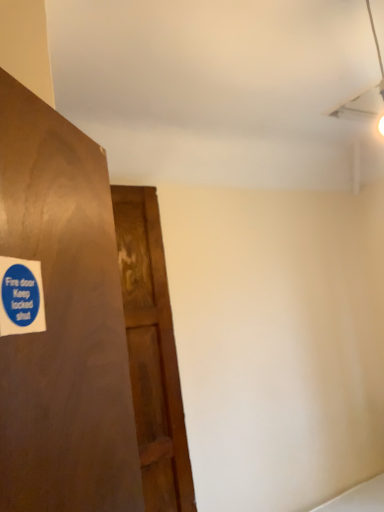
Question: Considering the relative positions of blue paper sticker at left and wooden door at left in the image provided, is blue paper sticker at left to the left of wooden door at left from the viewer's perspective?

Choices:
 (A) yes
 (B) no

Answer: (A)

Question: From a real-world perspective, is blue paper sticker at left located beneath wooden door at left?

Choices:
 (A) no
 (B) yes

Answer: (A)

Question: Is blue paper sticker at left in contact with wooden door at left?

Choices:
 (A) yes
 (B) no

Answer: (B)

Question: Could you tell me if blue paper sticker at left is turned towards wooden door at left?

Choices:
 (A) yes
 (B) no

Answer: (B)

Question: Does blue paper sticker at left have a lesser height compared to wooden door at left?

Choices:
 (A) no
 (B) yes

Answer: (B)

Question: Is wooden door at left located within blue paper sticker at left?

Choices:
 (A) yes
 (B) no

Answer: (B)

Question: Considering the relative sizes of wooden door at left and blue paper sticker at left in the image provided, is wooden door at left shorter than blue paper sticker at left?

Choices:
 (A) no
 (B) yes

Answer: (A)

Question: Is wooden door at left to the left of blue paper sticker at left from the viewer's perspective?

Choices:
 (A) no
 (B) yes

Answer: (A)

Question: Is blue paper sticker at left surrounded by wooden door at left?

Choices:
 (A) yes
 (B) no

Answer: (B)

Question: Considering the relative positions of wooden door at left and blue paper sticker at left in the image provided, is wooden door at left to the right of blue paper sticker at left from the viewer's perspective?

Choices:
 (A) no
 (B) yes

Answer: (B)

Question: Is wooden door at left closer to camera compared to blue paper sticker at left?

Choices:
 (A) yes
 (B) no

Answer: (B)

Question: Is wooden door at left completely or partially outside of blue paper sticker at left?

Choices:
 (A) no
 (B) yes

Answer: (B)

Question: In terms of height, does blue paper sticker at left look taller or shorter compared to wooden door at left?

Choices:
 (A) short
 (B) tall

Answer: (A)